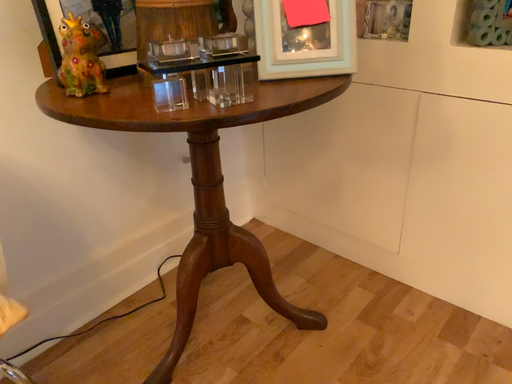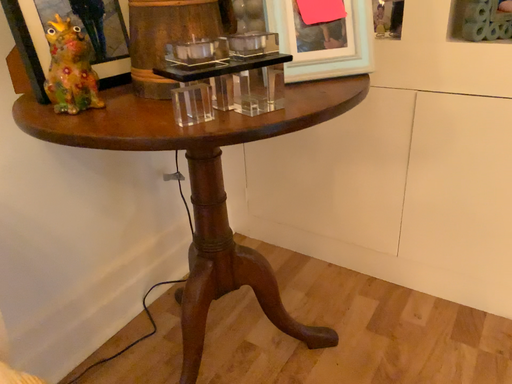
Question: Which way did the camera rotate in the video?

Choices:
 (A) rotated right
 (B) rotated left

Answer: (A)